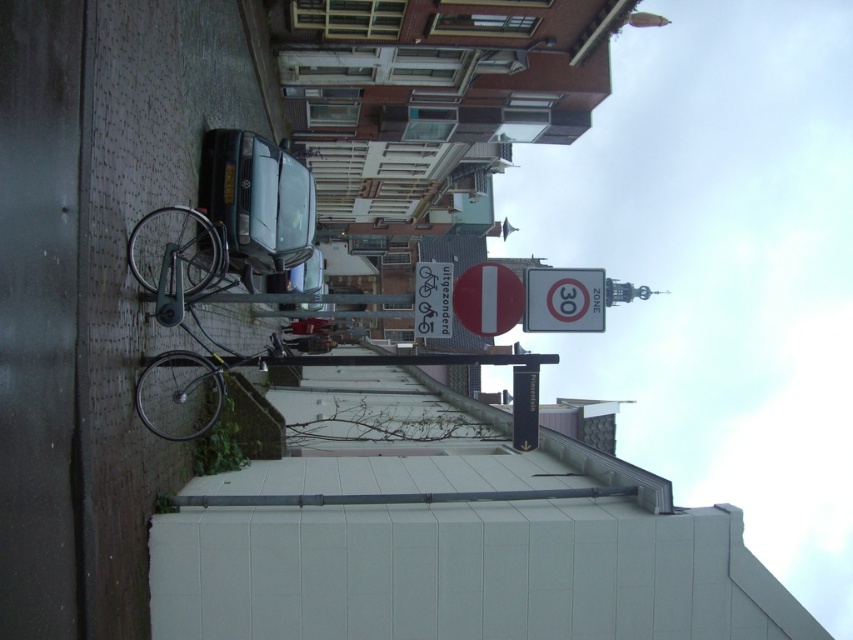
Who is taller, silver metallic bicycle at left or white plastic sign at center?

Standing taller between the two is white plastic sign at center.

Is silver metallic bicycle at left bigger than white plastic sign at center?

No.

Between point (200, 227) and point (428, 323), which one is positioned behind?

The point (200, 227) is behind.

Find the location of `silver metallic bicycle at left`. silver metallic bicycle at left is located at coordinates (177, 248).

Consider the image. Is the position of silver metallic speed limit sign at center less distant than that of white plastic sign at center?

No.

Is silver metallic speed limit sign at center to the left of white plastic sign at center from the viewer's perspective?

In fact, silver metallic speed limit sign at center is to the right of white plastic sign at center.

Which is behind, point (531, 285) or point (442, 266)?

Point (442, 266)

This screenshot has width=853, height=640. Find the location of `silver metallic speed limit sign at center`. silver metallic speed limit sign at center is located at coordinates (564, 300).

In the scene shown: Does silver metallic bicycle at left appear over silver metallic speed limit sign at center?

Yes, silver metallic bicycle at left is above silver metallic speed limit sign at center.

Between point (149, 269) and point (590, 320), which one is positioned behind?

The point (149, 269) is more distant.

Locate an element on the screen. silver metallic bicycle at left is located at coordinates (177, 248).